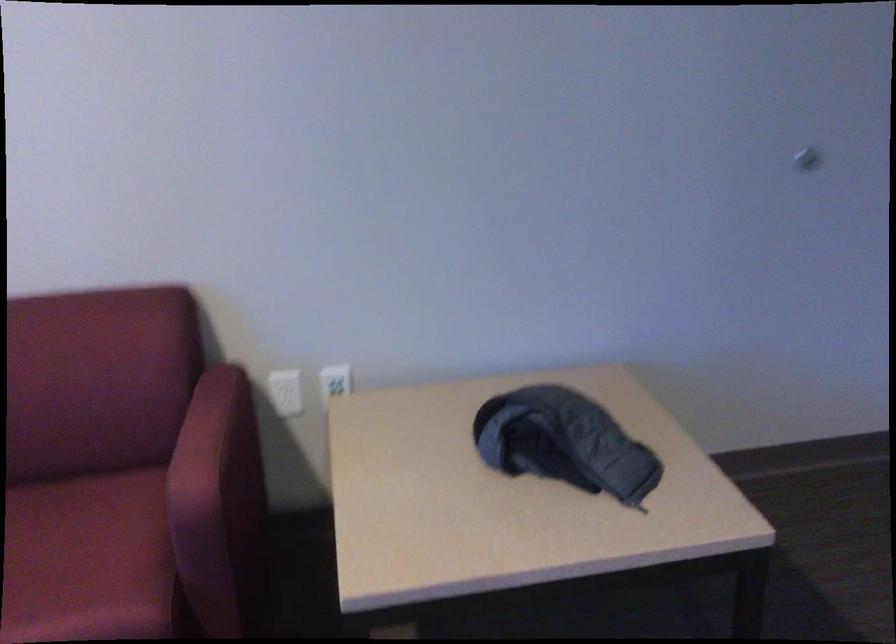
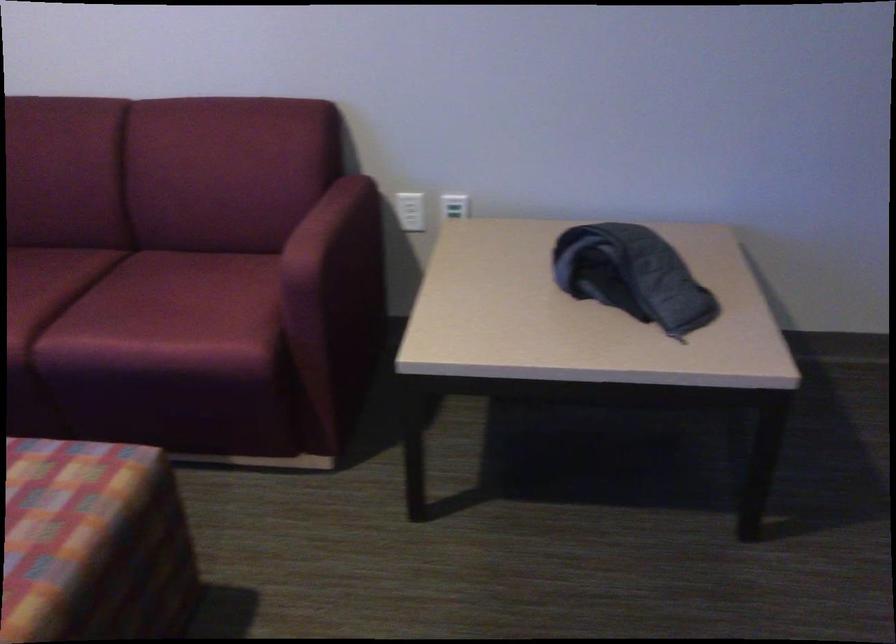
Locate, in the second image, the point that corresponds to the point at 231,478 in the first image.

(334, 259)